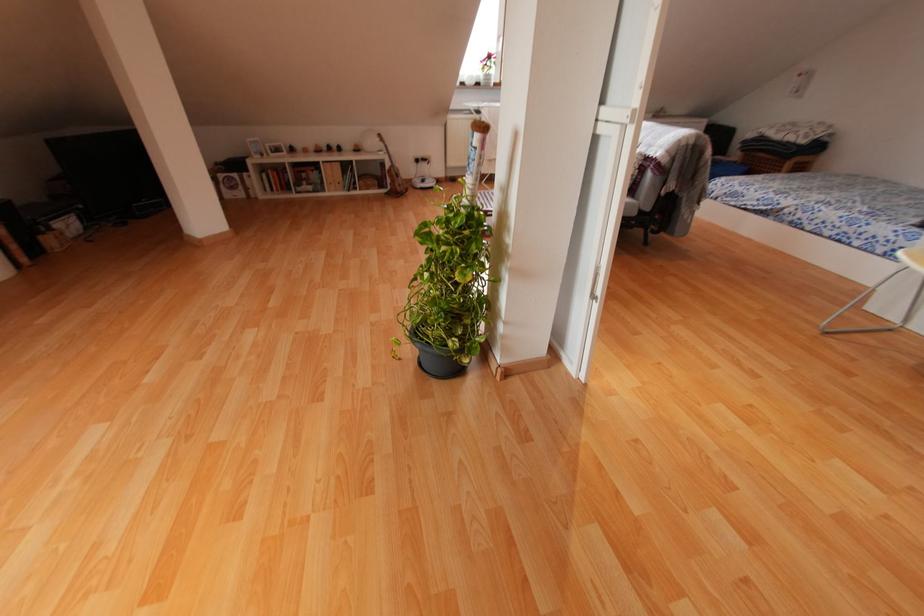
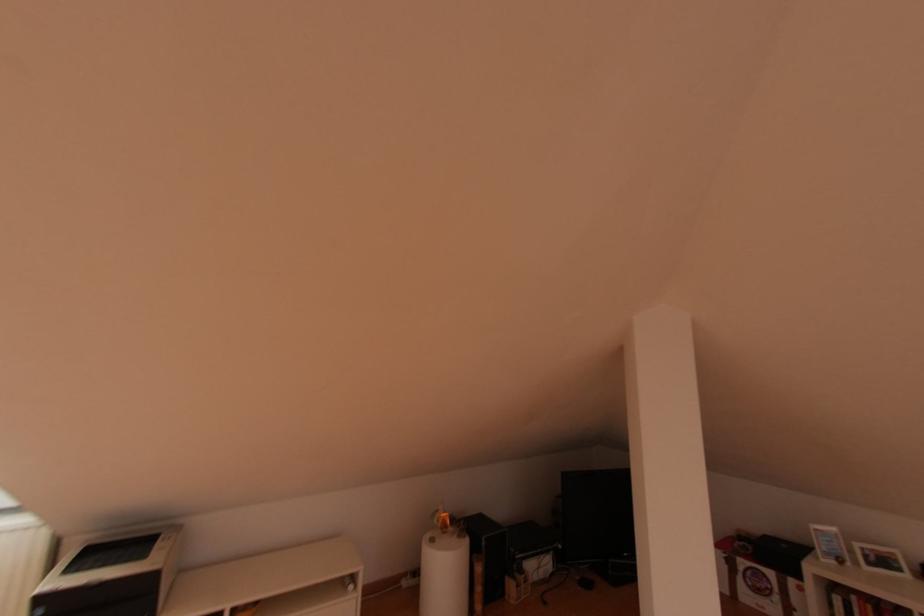
In the second image, find the point that corresponds to pixel 235 176 in the first image.

(771, 573)